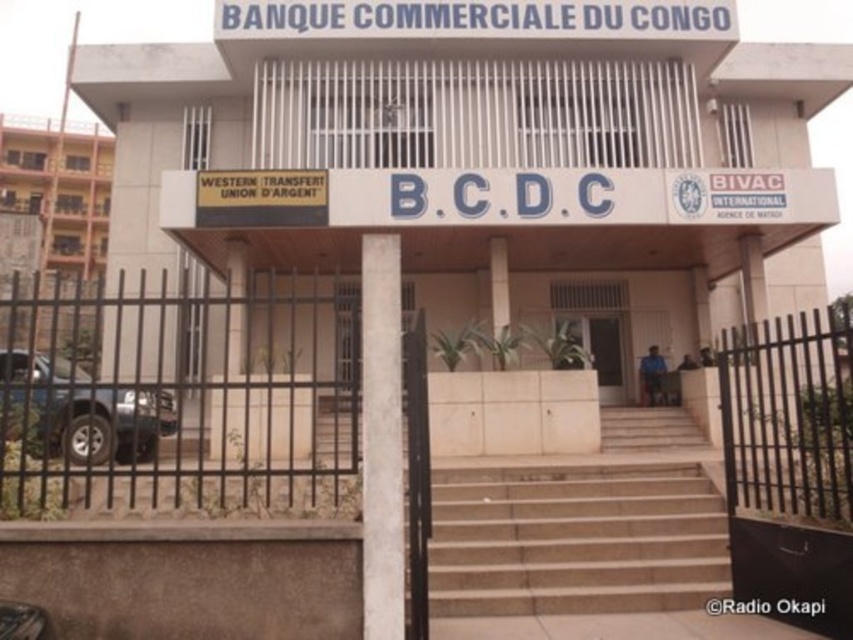
Question: Does beige concrete stairs at center have a greater width compared to white concrete pole at center?

Choices:
 (A) no
 (B) yes

Answer: (B)

Question: Among these objects, which one is nearest to the camera?

Choices:
 (A) beige concrete stairs at center
 (B) blue metallic car at lower left
 (C) white concrete pole at center

Answer: (C)

Question: Which is farther from the blue metallic car at lower left?

Choices:
 (A) white concrete pole at center
 (B) beige concrete stairs at center

Answer: (A)

Question: Which of the following is the farthest from the observer?

Choices:
 (A) white concrete pole at center
 (B) blue metallic car at lower left

Answer: (B)

Question: Does beige concrete stairs at center appear on the left side of white concrete pole at center?

Choices:
 (A) no
 (B) yes

Answer: (A)

Question: Where is beige concrete stairs at center located in relation to blue metallic car at lower left in the image?

Choices:
 (A) below
 (B) above

Answer: (A)